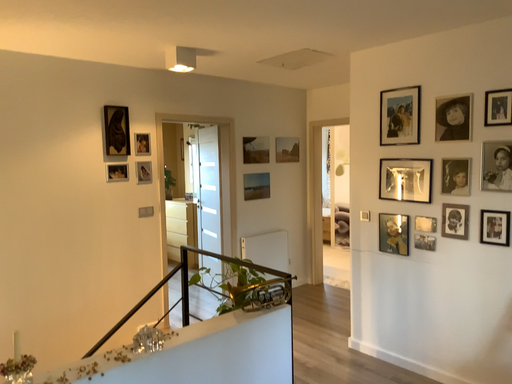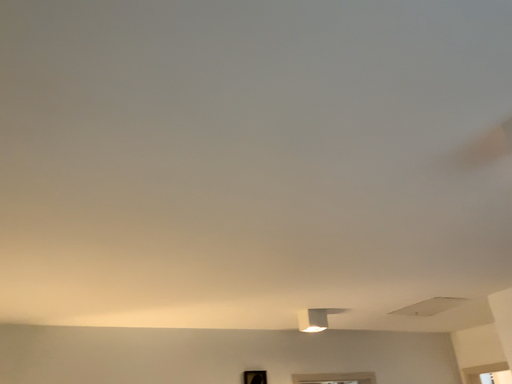
Question: Which way did the camera rotate in the video?

Choices:
 (A) rotated right
 (B) rotated left

Answer: (B)